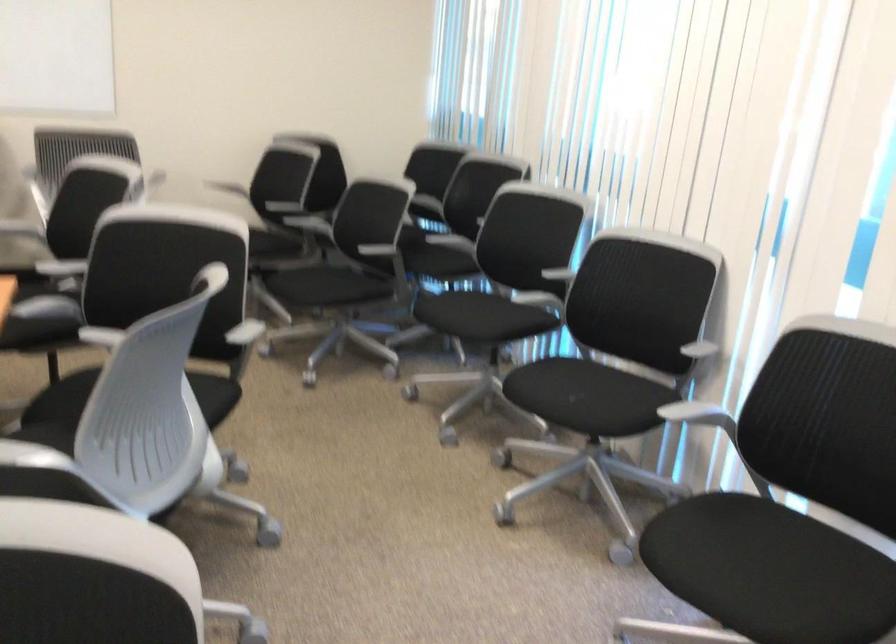
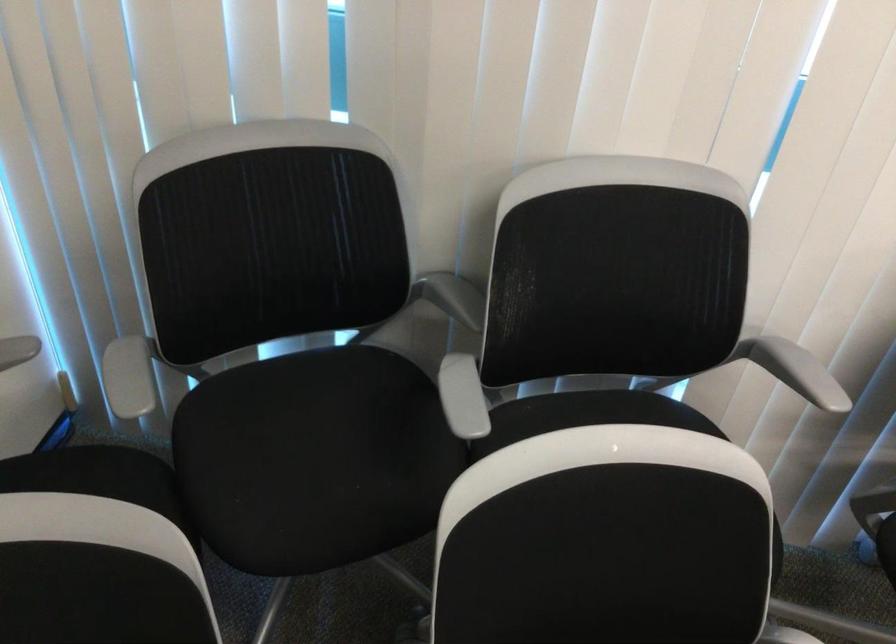
The point at (407,228) is marked in the first image. Where is the corresponding point in the second image?

(312, 442)